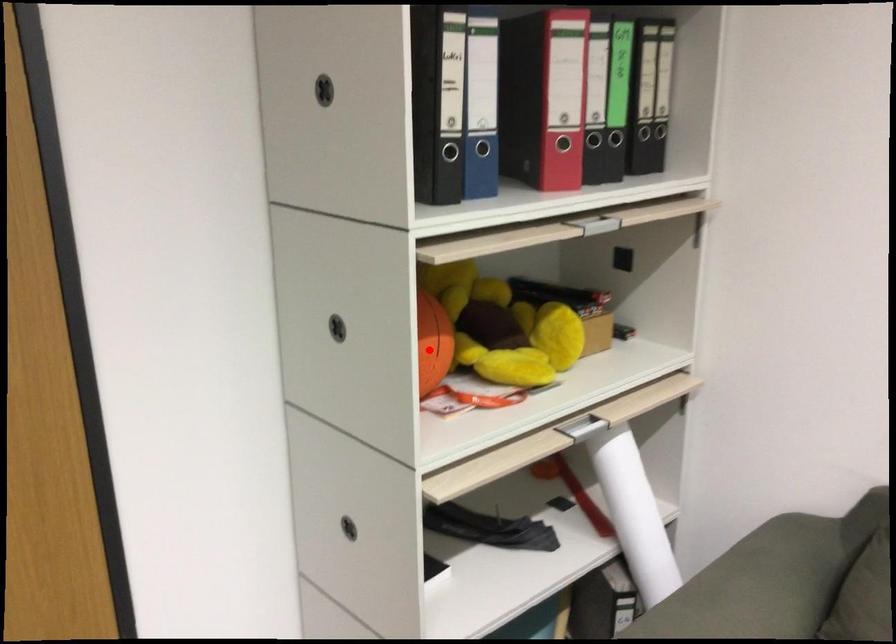
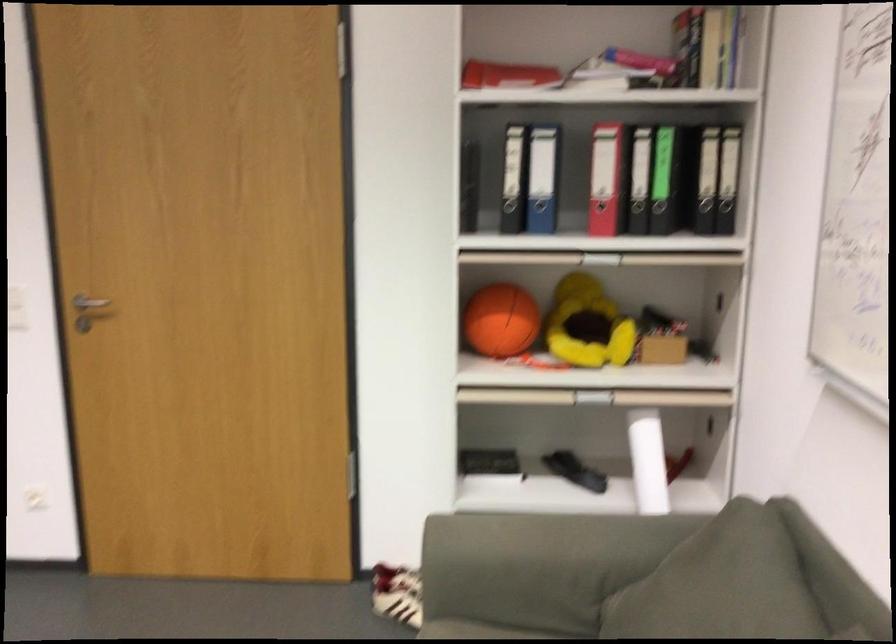
Where in the second image is the point corresponding to the highlighted location from the first image?

(501, 321)